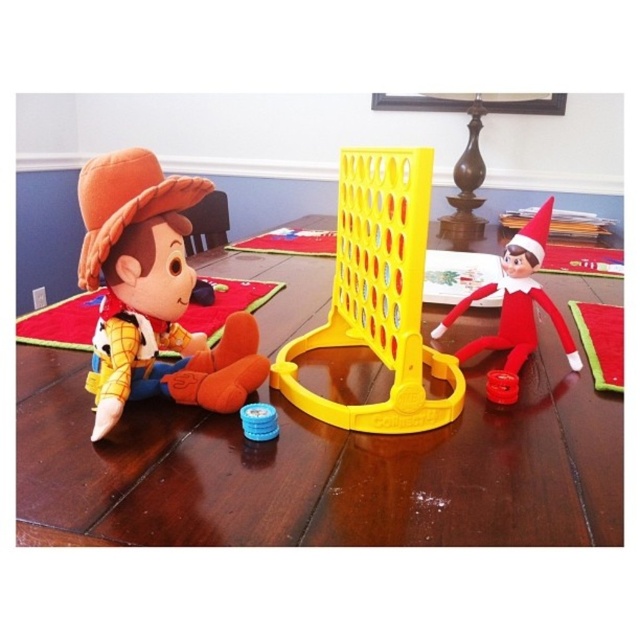
Question: Can you confirm if satin red elf at right is smaller than blue plastic game piece at center?

Choices:
 (A) yes
 (B) no

Answer: (B)

Question: Is wooden table at center smaller than yellow plastic game at center?

Choices:
 (A) yes
 (B) no

Answer: (B)

Question: Can you confirm if yellow plastic game at center is positioned to the right of blue plastic game piece at center?

Choices:
 (A) yes
 (B) no

Answer: (A)

Question: Among these points, which one is farthest from the camera?

Choices:
 (A) (273, 426)
 (B) (544, 305)
 (C) (401, 198)

Answer: (B)

Question: Based on their relative distances, which object is nearer to the yellow plastic game at center?

Choices:
 (A) satin red elf at right
 (B) blue plastic game piece at center
 (C) matte orange plush at left

Answer: (C)

Question: Which of these objects is positioned closest to the matte orange plush at left?

Choices:
 (A) blue plastic game piece at center
 (B) satin red elf at right
 (C) yellow plastic game at center
 (D) wooden table at center

Answer: (A)